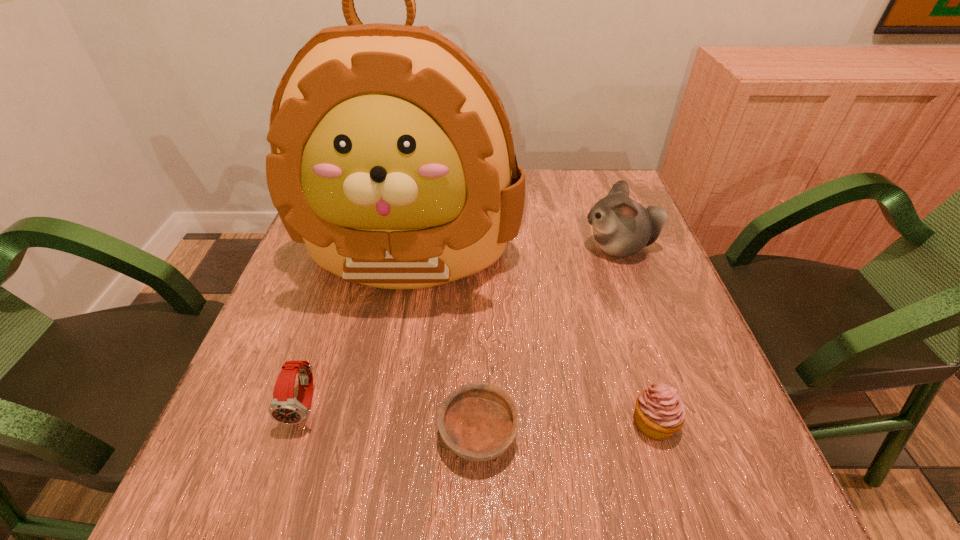
The image size is (960, 540). In the image, there is a desktop. What are the coordinates of `vacant space at the near edge` in the screenshot? It's located at (524, 510).

This screenshot has height=540, width=960. In order to click on free spot at the left edge of the desktop in this screenshot , I will do `click(241, 440)`.

Identify the location of free region at the right edge of the desktop. The height and width of the screenshot is (540, 960). (714, 438).

Locate an element on the screen. blank area at the near left corner is located at coordinates (196, 513).

Where is `free space at the far right corner`? This screenshot has height=540, width=960. free space at the far right corner is located at coordinates pyautogui.click(x=573, y=178).

Identify the location of vacant area at the near right corner. This screenshot has width=960, height=540. (763, 502).

This screenshot has width=960, height=540. Find the location of `free space between the fourth shortest object and the cupcake`. free space between the fourth shortest object and the cupcake is located at coordinates (636, 335).

Identify the location of vacant area that lies between the hamster and the bowl. (549, 340).

Where is `vacant point located between the watch and the second tallest object`? The height and width of the screenshot is (540, 960). vacant point located between the watch and the second tallest object is located at coordinates (462, 326).

You are a GUI agent. You are given a task and a screenshot of the screen. Output one action in this format:
    pyautogui.click(x=<x>, y=<y>)
    Task: Click on the blank region between the backpack and the cupcake
    This screenshot has height=540, width=960.
    Given the screenshot: What is the action you would take?
    pyautogui.click(x=532, y=337)